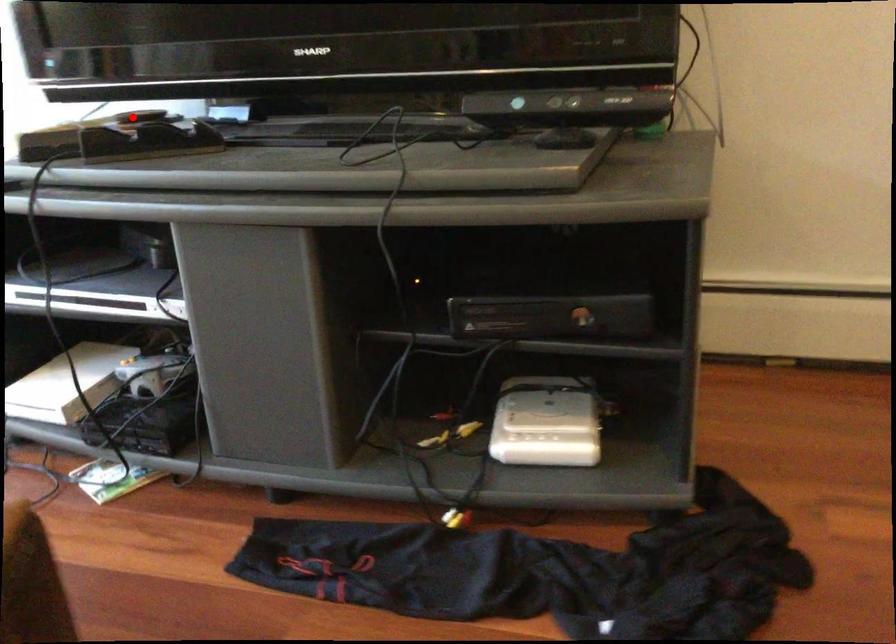
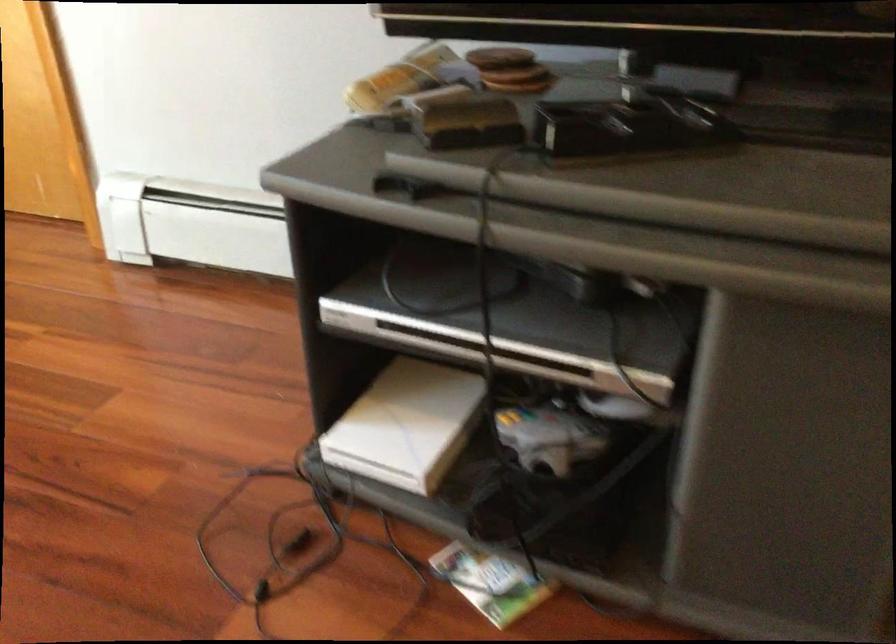
The point at the highlighted location is marked in the first image. Where is the corresponding point in the second image?

(500, 58)